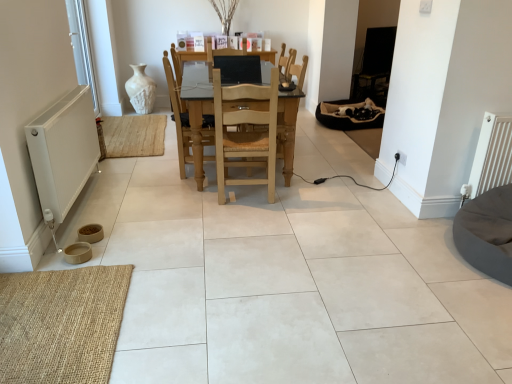
Locate an element on the screen. vacant space situated on the left part of dark gray fabric bean bag at lower right, arranged as the second bean bag chair when viewed from the back is located at coordinates click(409, 256).